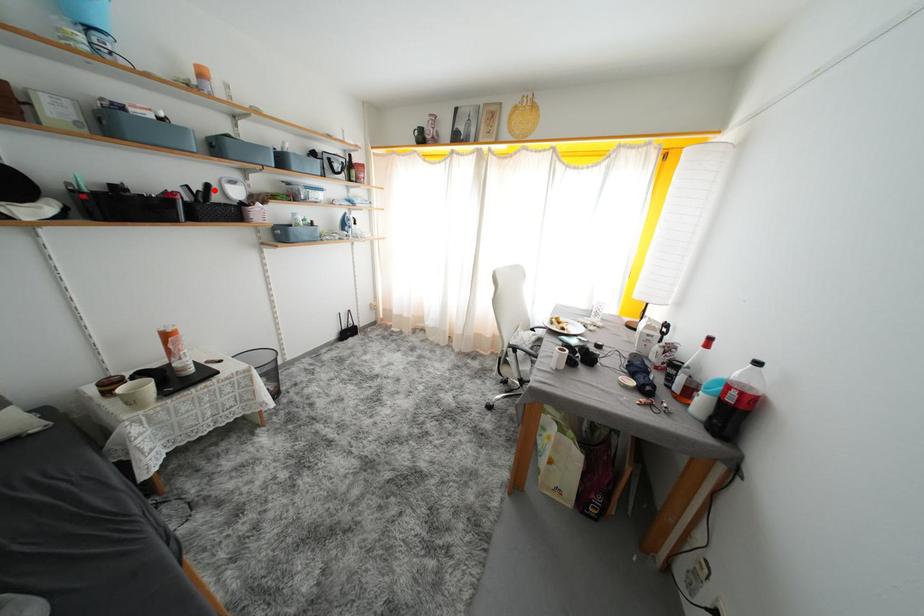
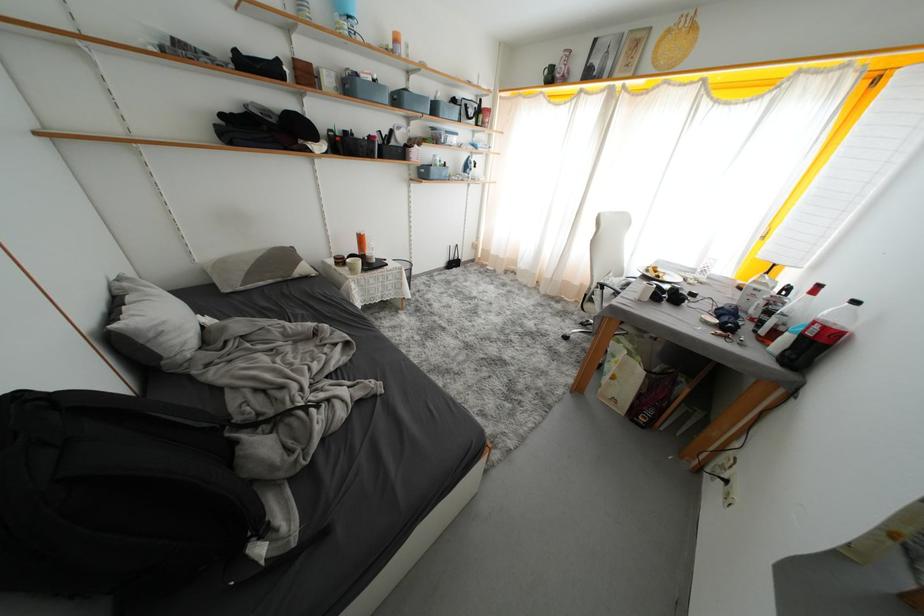
Question: I am providing you with two images of the same scene from different viewpoints. A red point is shown in image1. For the corresponding object point in image2, is it positioned nearer or farther from the camera?

Choices:
 (A) Nearer
 (B) Farther

Answer: (A)